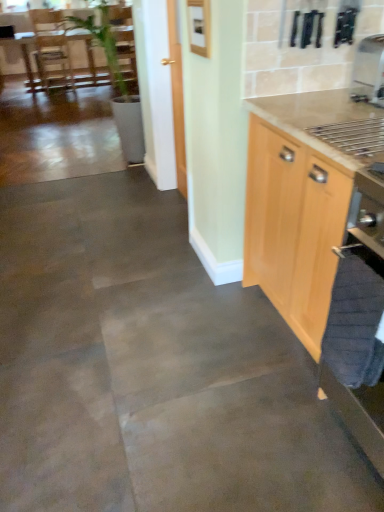
Question: In terms of width, does satin silver coffee machine at upper right look wider or thinner when compared to light wood cabinet at right?

Choices:
 (A) thin
 (B) wide

Answer: (A)

Question: Considering the relative positions of satin silver coffee machine at upper right and light wood cabinet at right in the image provided, is satin silver coffee machine at upper right to the left or to the right of light wood cabinet at right?

Choices:
 (A) left
 (B) right

Answer: (B)

Question: Which object is the farthest from the light wood cabinet at right?

Choices:
 (A) brown wooden table at upper left
 (B) satin silver coffee machine at upper right

Answer: (A)

Question: Estimate the real-world distances between objects in this image. Which object is closer to the satin silver coffee machine at upper right?

Choices:
 (A) brown wooden table at upper left
 (B) light wood cabinet at right

Answer: (B)